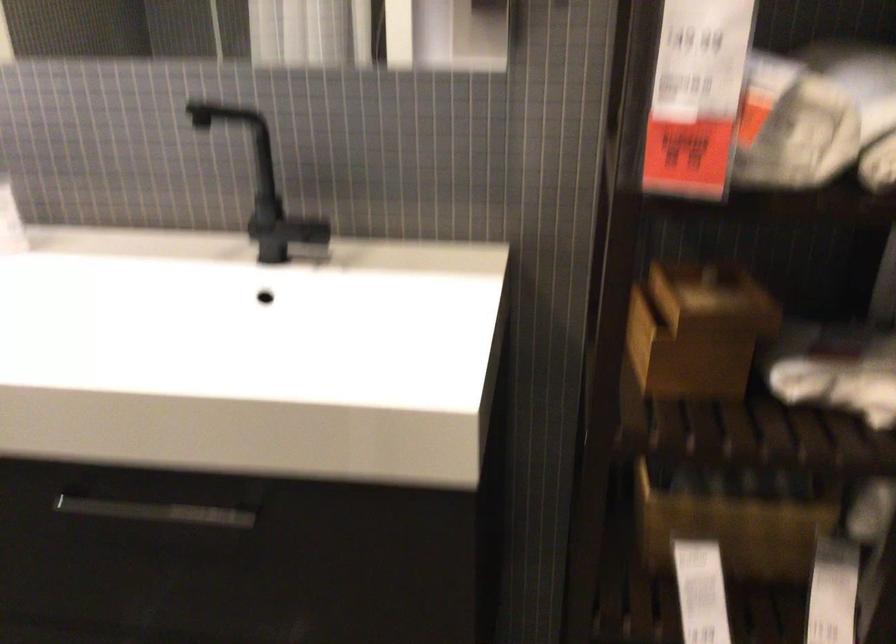
Where would you pull the silver drawer handle? Please return your answer as a coordinate pair (x, y).

(152, 509)